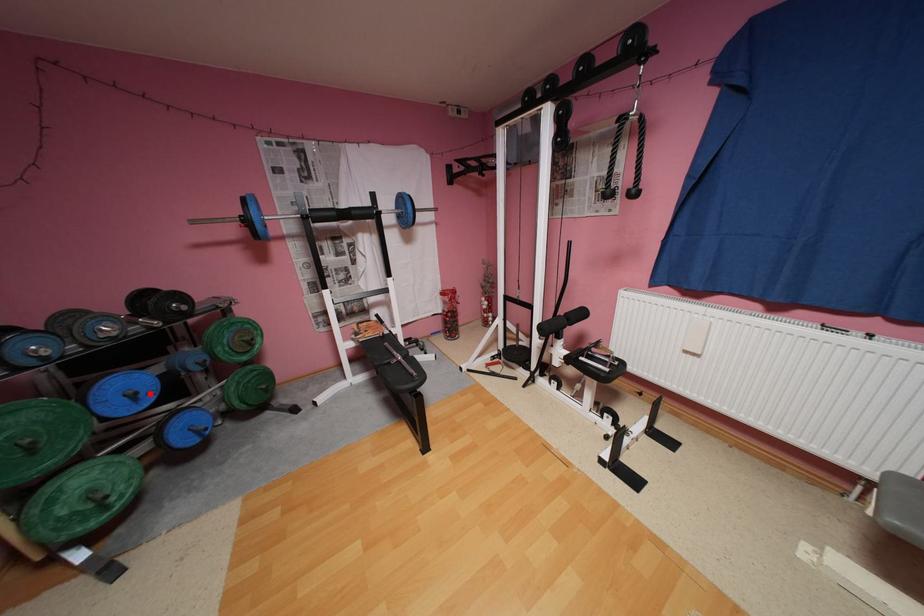
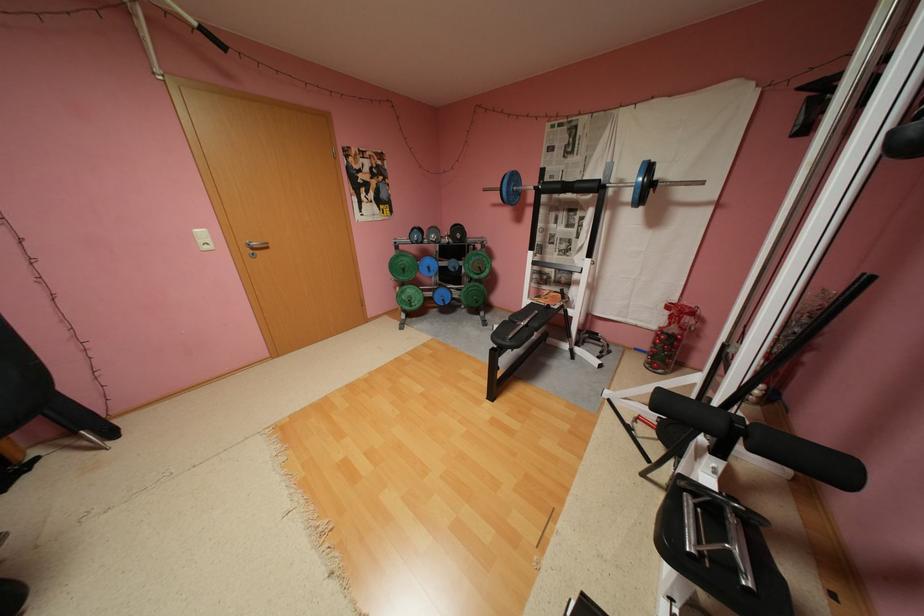
Locate, in the second image, the point that corresponds to the highlighted location in the first image.

(441, 269)